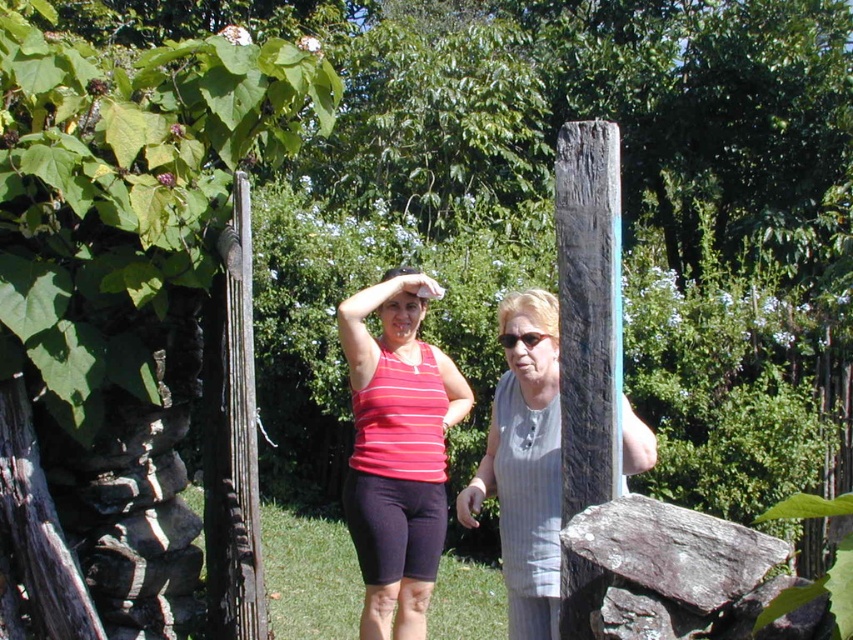
Question: Which object is closer to the camera taking this photo?

Choices:
 (A) gray striped dress at center
 (B) matte black sunglasses at center

Answer: (A)

Question: Which object is the closest to the matte black sunglasses at center?

Choices:
 (A) matte red tank top at center
 (B) weathered wood post at right

Answer: (B)

Question: Where is matte red tank top at center located in relation to gray striped dress at center in the image?

Choices:
 (A) above
 (B) below

Answer: (B)

Question: Is matte red tank top at center behind gray striped dress at center?

Choices:
 (A) no
 (B) yes

Answer: (B)

Question: Which point is farther from the camera taking this photo?

Choices:
 (A) (242, 348)
 (B) (532, 339)

Answer: (A)

Question: Is gray striped dress at center wider than weathered wood post at left?

Choices:
 (A) no
 (B) yes

Answer: (B)